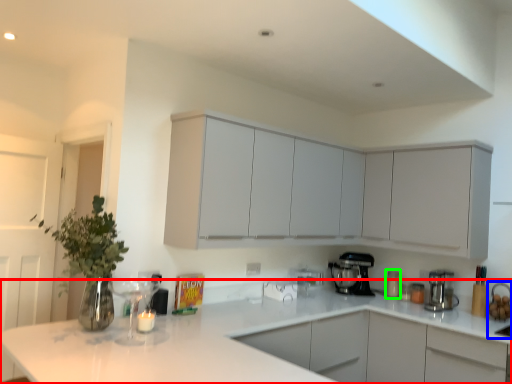
Question: Which object is positioned closest to countertop (highlighted by a red box)? Select from sink (highlighted by a blue box) and appliance (highlighted by a green box).

Choices:
 (A) sink
 (B) appliance

Answer: (A)